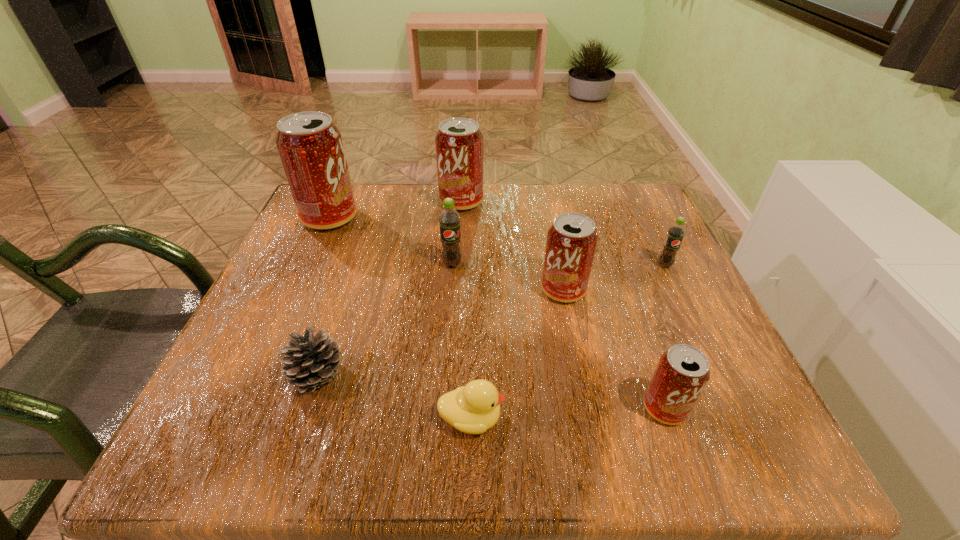
I want to click on the tallest soda can, so click(x=310, y=146).

Find the location of a particular element. This screenshot has height=540, width=960. the biggest red soda can is located at coordinates (310, 146).

Find the location of `the seventh shortest object`. the seventh shortest object is located at coordinates (459, 143).

This screenshot has width=960, height=540. What are the coordinates of `the second tallest soda can` in the screenshot? It's located at (459, 143).

In order to click on the second red soda can from right to left in this screenshot , I will do `click(571, 242)`.

Where is `the sixth object from left to right`? This screenshot has height=540, width=960. the sixth object from left to right is located at coordinates (571, 242).

Image resolution: width=960 pixels, height=540 pixels. Identify the location of the bigger green soda. (449, 219).

Where is `the smaller green soda`? The image size is (960, 540). the smaller green soda is located at coordinates (676, 232).

This screenshot has height=540, width=960. Identify the location of the right green soda. (676, 232).

Find the location of `the second object from right to left`. the second object from right to left is located at coordinates click(x=682, y=372).